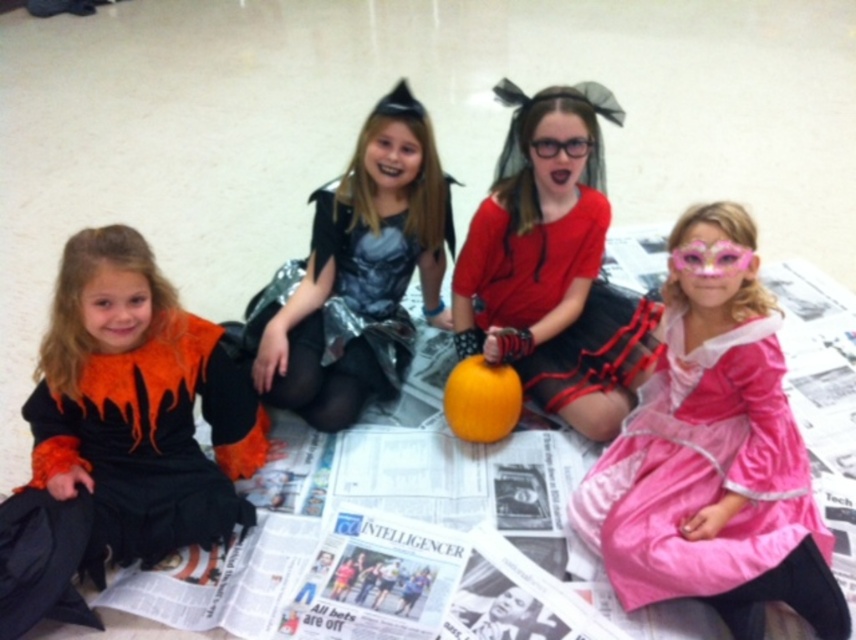
Who is taller, pink satin dress at lower right or shiny silver dress at center?

With more height is shiny silver dress at center.

Is pink satin dress at lower right to the left of shiny silver dress at center from the viewer's perspective?

In fact, pink satin dress at lower right is to the right of shiny silver dress at center.

You are a GUI agent. You are given a task and a screenshot of the screen. Output one action in this format:
    pyautogui.click(x=<x>, y=<y>)
    Task: Click on the pink satin dress at lower right
    
    Given the screenshot: What is the action you would take?
    pyautogui.click(x=712, y=486)

Where is `pink satin dress at lower right`? Image resolution: width=856 pixels, height=640 pixels. pink satin dress at lower right is located at coordinates (712, 486).

Which is more to the left, matte red dress at center or shiny silver dress at center?

Positioned to the left is shiny silver dress at center.

Who is more forward, (500, 301) or (415, 161)?

Point (415, 161) is in front.

This screenshot has height=640, width=856. In order to click on matte red dress at center in this screenshot , I will do `click(553, 266)`.

This screenshot has width=856, height=640. What do you see at coordinates (712, 486) in the screenshot?
I see `pink satin dress at lower right` at bounding box center [712, 486].

Is pink satin dress at lower right closer to camera compared to matte red dress at center?

Yes.

Where is `pink satin dress at lower right`? This screenshot has width=856, height=640. pink satin dress at lower right is located at coordinates (712, 486).